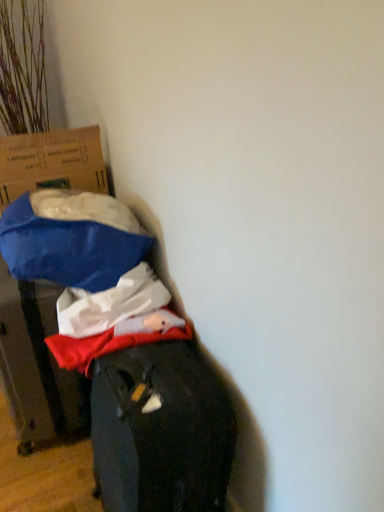
This screenshot has width=384, height=512. What are the coordinates of `blue cardboard box at left, the first cardboard box when ordered from top to bottom` in the screenshot? It's located at (51, 162).

What do you see at coordinates (51, 162) in the screenshot? The height and width of the screenshot is (512, 384). I see `blue cardboard box at left, arranged as the second cardboard box when ordered from the bottom` at bounding box center [51, 162].

Looking at this image, how much space does blue cardboard box at left, the first cardboard box when ordered from top to bottom, occupy horizontally?

blue cardboard box at left, the first cardboard box when ordered from top to bottom, is 20.61 inches wide.

Where is `blue fabric bag at left, the 1th cardboard box positioned from the bottom`? blue fabric bag at left, the 1th cardboard box positioned from the bottom is located at coordinates (36, 366).

Describe the element at coordinates (36, 366) in the screenshot. This screenshot has height=512, width=384. I see `blue fabric bag at left, the 1th cardboard box positioned from the bottom` at that location.

You are a GUI agent. You are given a task and a screenshot of the screen. Output one action in this format:
    pyautogui.click(x=<x>, y=<y>)
    Task: Click on the blue cardboard box at left, the first cardboard box when ordered from top to bottom
    Image resolution: width=384 pixels, height=512 pixels.
    Given the screenshot: What is the action you would take?
    pyautogui.click(x=51, y=162)

Which object is positioned more to the right, blue cardboard box at left, the first cardboard box when ordered from top to bottom, or blue fabric bag at left, the 1th cardboard box positioned from the bottom?

From the viewer's perspective, blue fabric bag at left, the 1th cardboard box positioned from the bottom, appears more on the right side.

Which object is closer to the camera taking this photo, blue cardboard box at left, the first cardboard box when ordered from top to bottom, or blue fabric bag at left, the 2th cardboard box when ordered from top to bottom?

blue fabric bag at left, the 2th cardboard box when ordered from top to bottom, is closer to the camera.

Does point (16, 166) come behind point (50, 386)?

That is True.

From the image's perspective, is blue cardboard box at left, arranged as the second cardboard box when ordered from the bottom, on top of blue fabric bag at left, the 1th cardboard box positioned from the bottom?

Yes.

From a real-world perspective, is blue cardboard box at left, the first cardboard box when ordered from top to bottom, positioned over blue fabric bag at left, the 1th cardboard box positioned from the bottom, based on gravity?

Correct, in the physical world, blue cardboard box at left, the first cardboard box when ordered from top to bottom, is higher than blue fabric bag at left, the 1th cardboard box positioned from the bottom.

Looking at their sizes, would you say blue cardboard box at left, the first cardboard box when ordered from top to bottom, is wider or thinner than blue fabric bag at left, the 2th cardboard box when ordered from top to bottom?

blue cardboard box at left, the first cardboard box when ordered from top to bottom, is thinner than blue fabric bag at left, the 2th cardboard box when ordered from top to bottom.

Is blue cardboard box at left, the first cardboard box when ordered from top to bottom, shorter than blue fabric bag at left, the 2th cardboard box when ordered from top to bottom?

Indeed, blue cardboard box at left, the first cardboard box when ordered from top to bottom, has a lesser height compared to blue fabric bag at left, the 2th cardboard box when ordered from top to bottom.

Can you confirm if blue cardboard box at left, arranged as the second cardboard box when ordered from the bottom, is bigger than blue fabric bag at left, the 1th cardboard box positioned from the bottom?

Actually, blue cardboard box at left, arranged as the second cardboard box when ordered from the bottom, might be smaller than blue fabric bag at left, the 1th cardboard box positioned from the bottom.

Is blue cardboard box at left, arranged as the second cardboard box when ordered from the bottom, positioned beyond the bounds of blue fabric bag at left, the 1th cardboard box positioned from the bottom?

Yes, blue cardboard box at left, arranged as the second cardboard box when ordered from the bottom, is not within blue fabric bag at left, the 1th cardboard box positioned from the bottom.

Is blue cardboard box at left, the first cardboard box when ordered from top to bottom, touching blue fabric bag at left, the 1th cardboard box positioned from the bottom?

No, blue cardboard box at left, the first cardboard box when ordered from top to bottom, is not touching blue fabric bag at left, the 1th cardboard box positioned from the bottom.

Could you tell me if blue cardboard box at left, arranged as the second cardboard box when ordered from the bottom, is facing blue fabric bag at left, the 1th cardboard box positioned from the bottom?

No, blue cardboard box at left, arranged as the second cardboard box when ordered from the bottom, is not facing towards blue fabric bag at left, the 1th cardboard box positioned from the bottom.

How different are the orientations of blue cardboard box at left, arranged as the second cardboard box when ordered from the bottom, and blue fabric bag at left, the 1th cardboard box positioned from the bottom, in degrees?

The angle between the facing direction of blue cardboard box at left, arranged as the second cardboard box when ordered from the bottom, and the facing direction of blue fabric bag at left, the 1th cardboard box positioned from the bottom, is 0.694 degrees.

How far apart are blue cardboard box at left, the first cardboard box when ordered from top to bottom, and blue fabric bag at left, the 1th cardboard box positioned from the bottom?

blue cardboard box at left, the first cardboard box when ordered from top to bottom, is 24.95 inches from blue fabric bag at left, the 1th cardboard box positioned from the bottom.

You are a GUI agent. You are given a task and a screenshot of the screen. Output one action in this format:
    pyautogui.click(x=<x>, y=<y>)
    Task: Click on the cardboard box above the blue fabric bag at left, the 2th cardboard box when ordered from top to bottom (from a real-world perspective)
    The height and width of the screenshot is (512, 384).
    Given the screenshot: What is the action you would take?
    pyautogui.click(x=51, y=162)

Can you confirm if blue fabric bag at left, the 1th cardboard box positioned from the bottom, is positioned to the left of blue cardboard box at left, the first cardboard box when ordered from top to bottom?

No.

Which object is further away from the camera, blue fabric bag at left, the 1th cardboard box positioned from the bottom, or blue cardboard box at left, arranged as the second cardboard box when ordered from the bottom?

Positioned behind is blue cardboard box at left, arranged as the second cardboard box when ordered from the bottom.

Considering the points (40, 384) and (108, 190), which point is in front, point (40, 384) or point (108, 190)?

The point (40, 384) is in front.

From the image's perspective, which one is positioned lower, blue fabric bag at left, the 2th cardboard box when ordered from top to bottom, or blue cardboard box at left, arranged as the second cardboard box when ordered from the bottom?

blue fabric bag at left, the 2th cardboard box when ordered from top to bottom, from the image's perspective.

From a real-world perspective, is blue fabric bag at left, the 2th cardboard box when ordered from top to bottom, located higher than blue cardboard box at left, the first cardboard box when ordered from top to bottom?

No, from a real-world perspective, blue fabric bag at left, the 2th cardboard box when ordered from top to bottom, is not over blue cardboard box at left, the first cardboard box when ordered from top to bottom

Can you confirm if blue fabric bag at left, the 1th cardboard box positioned from the bottom, is thinner than blue cardboard box at left, the first cardboard box when ordered from top to bottom?

Incorrect, the width of blue fabric bag at left, the 1th cardboard box positioned from the bottom, is not less than that of blue cardboard box at left, the first cardboard box when ordered from top to bottom.

Considering the sizes of blue fabric bag at left, the 1th cardboard box positioned from the bottom, and blue cardboard box at left, arranged as the second cardboard box when ordered from the bottom, in the image, is blue fabric bag at left, the 1th cardboard box positioned from the bottom, taller or shorter than blue cardboard box at left, arranged as the second cardboard box when ordered from the bottom,?

In the image, blue fabric bag at left, the 1th cardboard box positioned from the bottom, appears to be taller than blue cardboard box at left, arranged as the second cardboard box when ordered from the bottom.

Can you confirm if blue fabric bag at left, the 1th cardboard box positioned from the bottom, is smaller than blue cardboard box at left, the first cardboard box when ordered from top to bottom?

Actually, blue fabric bag at left, the 1th cardboard box positioned from the bottom, might be larger than blue cardboard box at left, the first cardboard box when ordered from top to bottom.

Would you say blue fabric bag at left, the 2th cardboard box when ordered from top to bottom, is inside or outside blue cardboard box at left, arranged as the second cardboard box when ordered from the bottom?

blue fabric bag at left, the 2th cardboard box when ordered from top to bottom, exists outside the volume of blue cardboard box at left, arranged as the second cardboard box when ordered from the bottom.

Are blue fabric bag at left, the 2th cardboard box when ordered from top to bottom, and blue cardboard box at left, the first cardboard box when ordered from top to bottom, located far from each other?

No, blue fabric bag at left, the 2th cardboard box when ordered from top to bottom, is in close proximity to blue cardboard box at left, the first cardboard box when ordered from top to bottom.

Is blue fabric bag at left, the 2th cardboard box when ordered from top to bottom, facing away from blue cardboard box at left, arranged as the second cardboard box when ordered from the bottom?

That's not correct — blue fabric bag at left, the 2th cardboard box when ordered from top to bottom, is not looking away from blue cardboard box at left, arranged as the second cardboard box when ordered from the bottom.

What's the angular difference between blue fabric bag at left, the 1th cardboard box positioned from the bottom, and blue cardboard box at left, arranged as the second cardboard box when ordered from the bottom,'s facing directions?

0.694 degrees separate the facing orientations of blue fabric bag at left, the 1th cardboard box positioned from the bottom, and blue cardboard box at left, arranged as the second cardboard box when ordered from the bottom.

How far apart are blue fabric bag at left, the 2th cardboard box when ordered from top to bottom, and blue cardboard box at left, the first cardboard box when ordered from top to bottom?

The distance of blue fabric bag at left, the 2th cardboard box when ordered from top to bottom, from blue cardboard box at left, the first cardboard box when ordered from top to bottom, is 24.95 inches.

This screenshot has width=384, height=512. In order to click on cardboard box on the right side of blue cardboard box at left, the first cardboard box when ordered from top to bottom in this screenshot , I will do `click(36, 366)`.

This screenshot has height=512, width=384. Find the location of `cardboard box above the blue fabric bag at left, the 2th cardboard box when ordered from top to bottom (from a real-world perspective)`. cardboard box above the blue fabric bag at left, the 2th cardboard box when ordered from top to bottom (from a real-world perspective) is located at coordinates [x=51, y=162].

The height and width of the screenshot is (512, 384). In order to click on cardboard box below the blue cardboard box at left, the first cardboard box when ordered from top to bottom (from a real-world perspective) in this screenshot , I will do `click(36, 366)`.